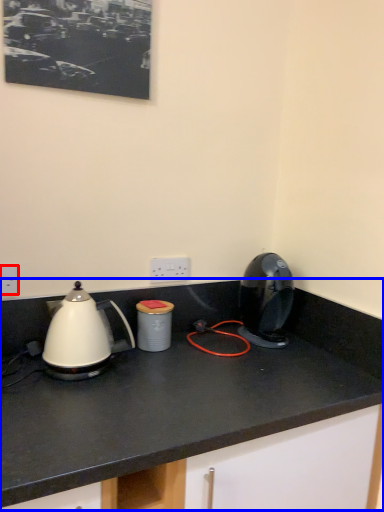
Question: Which object is closer to the camera taking this photo, electric outlet (highlighted by a red box) or countertop (highlighted by a blue box)?

Choices:
 (A) electric outlet
 (B) countertop

Answer: (B)